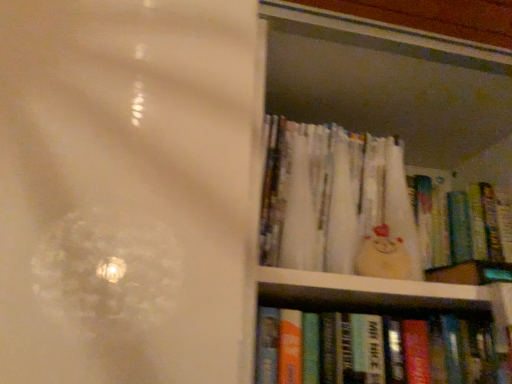
Question: From a real-world perspective, is hardcover books at right positioned above or below white paper book at upper right, the 3th book positioned from the bottom?

Choices:
 (A) below
 (B) above

Answer: (A)

Question: Is hardcover books at right bigger or smaller than white paper book at upper right, which is the 1th book in top-to-bottom order?

Choices:
 (A) big
 (B) small

Answer: (A)

Question: Which of these objects is positioned closest to the hardcover books at right?

Choices:
 (A) white paper book at upper right, the 3th book positioned from the bottom
 (B) hardcover book at lower right, which is the first book from bottom to top
 (C) matte plastic book at upper right, the second book ordered from the bottom

Answer: (A)

Question: Which of these objects is positioned farthest from the hardcover books at right?

Choices:
 (A) white paper book at upper right, the 3th book positioned from the bottom
 (B) matte plastic book at upper right, which is the second book from top to bottom
 (C) hardcover book at lower right, the 3th book viewed from the top

Answer: (C)